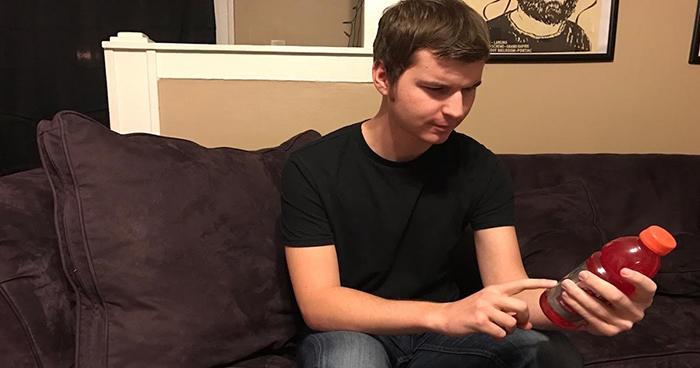
At what (x,y) coordinates should I click in order to perform the action: click on brown sofa. Please return your answer as a coordinate pair (x, y). This screenshot has height=368, width=700. Looking at the image, I should click on (607, 216).